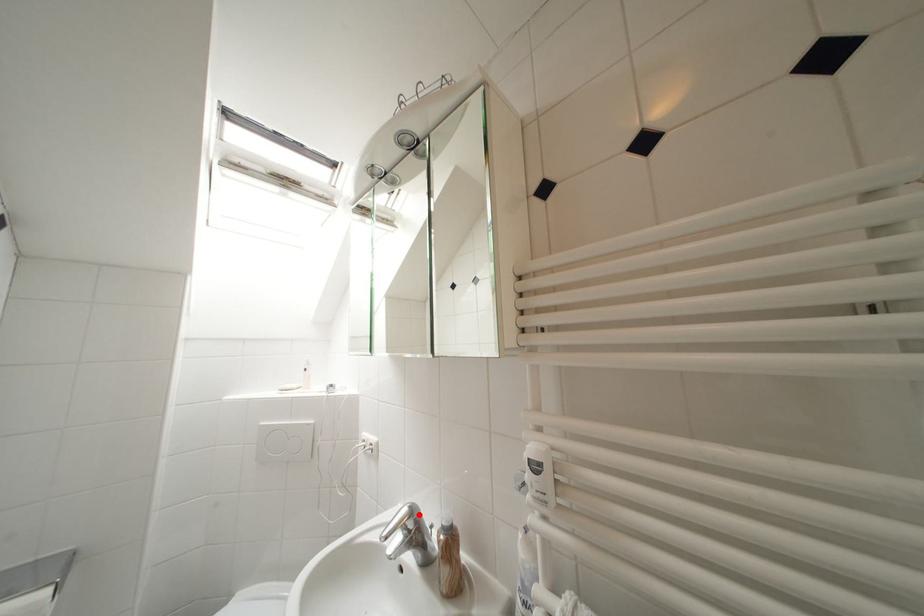
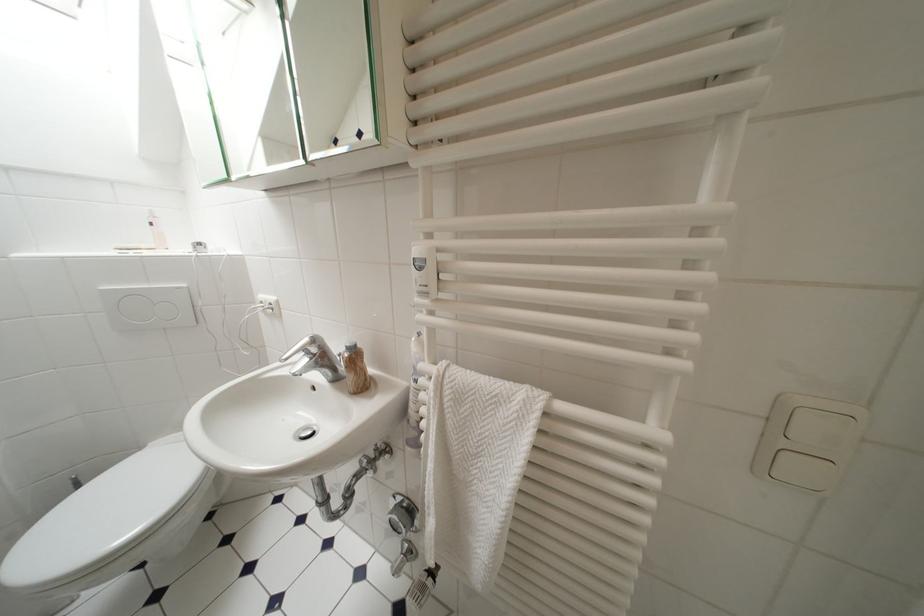
The point at the highlighted location is marked in the first image. Where is the corresponding point in the second image?

(322, 342)